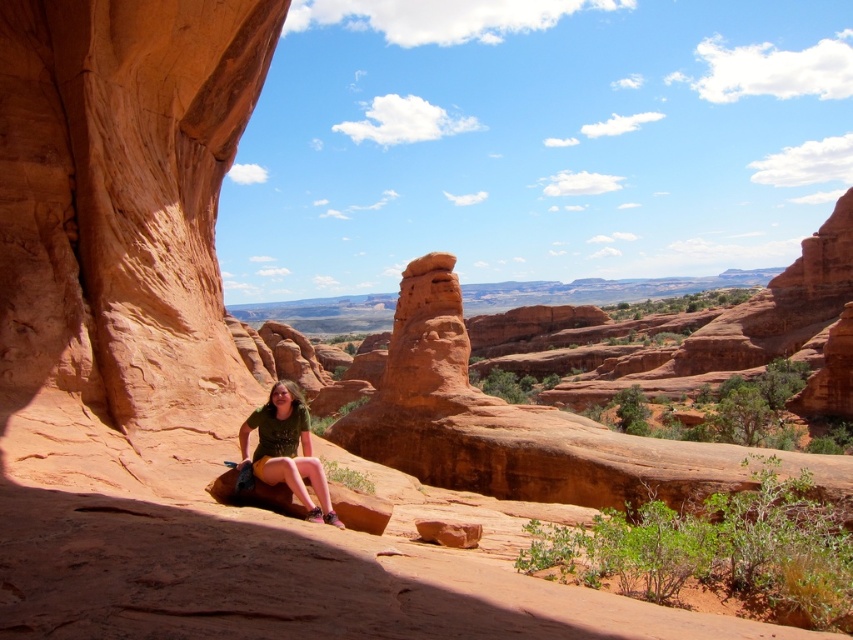
From the picture: You are standing in the desert scene and want to move from the point at coordinates point [241,426] to the point at coordinates point [418,528]. Which direction should you face to walk towards the second point?

Since point [241,426] is closer to you than point [418,528], you should face away from the viewer to walk towards the second point.